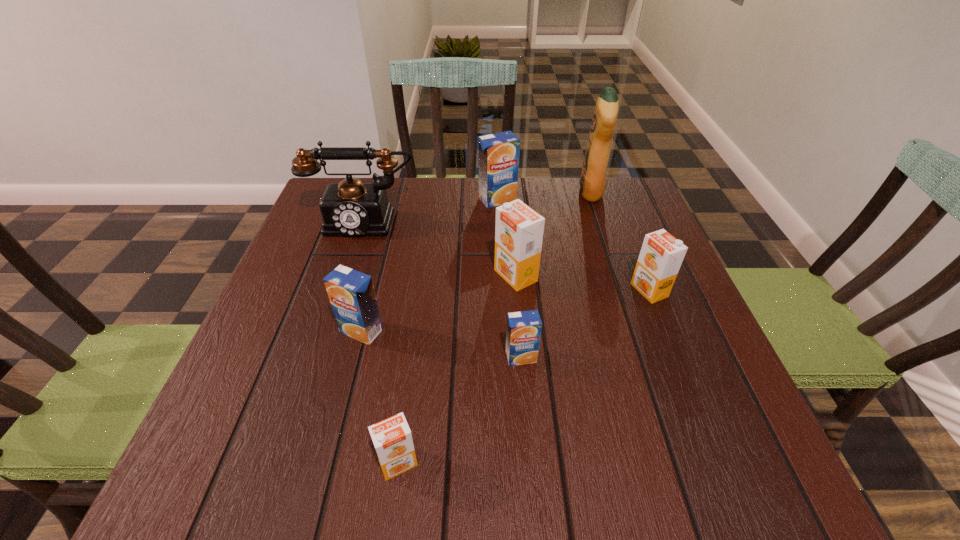
Locate an element on the screen. Image resolution: width=960 pixels, height=540 pixels. vacant area between the nearest blue orange_juice and the gray telephone is located at coordinates (443, 288).

I want to click on free area in between the second tallest object and the biggest orange orange juice, so click(440, 247).

Where is `free space that is in between the tallest object and the rightmost orange orange juice`? free space that is in between the tallest object and the rightmost orange orange juice is located at coordinates (620, 241).

This screenshot has width=960, height=540. In order to click on free space between the second biggest blue orange_juice and the detergent in this screenshot , I will do (476, 262).

Identify the location of vacant area that lies between the rightmost orange orange juice and the farthest orange juice. The width and height of the screenshot is (960, 540). (573, 245).

Identify the location of free space between the second orange juice from left to right and the rightmost orange juice. (524, 377).

This screenshot has height=540, width=960. Identify the location of free space that is in between the gray telephone and the nearest orange juice. (381, 341).

Where is `vacant area that lies between the leftmost orange juice and the rightmost orange juice`? The width and height of the screenshot is (960, 540). vacant area that lies between the leftmost orange juice and the rightmost orange juice is located at coordinates (505, 310).

I want to click on object that can be found as the closest to the third nearest orange juice, so click(392, 438).

Locate which object is the fifth closest to the leftmost blue orange_juice. Please provide its 2D coordinates. Your answer should be formatted as a tuple, i.e. [(x, y)], where the tuple contains the x and y coordinates of a point satisfying the conditions above.

[(498, 153)]